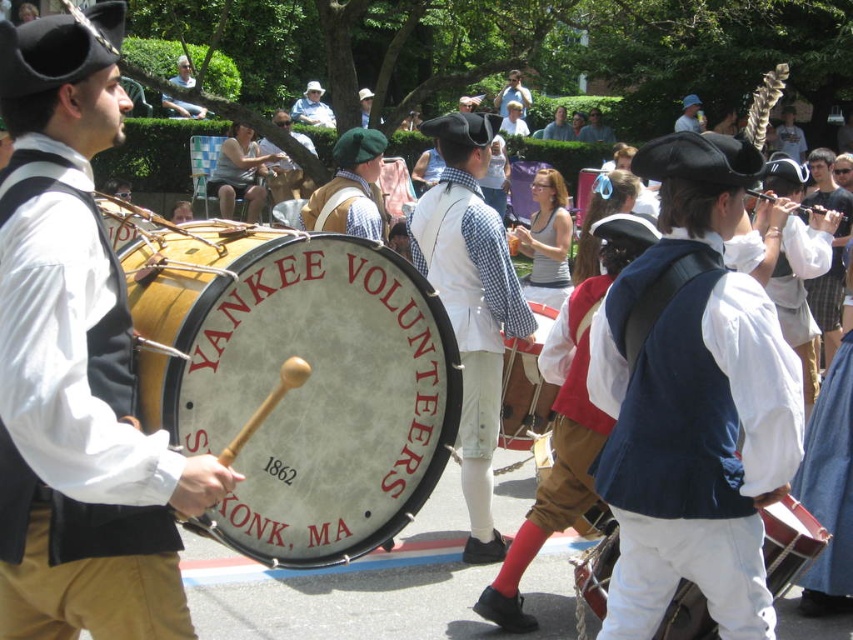
You are a photographer trying to capture the entire group in a single shot. You notice the wooden drum at center and the blue denim hat at upper center. Which object should you focus on first to ensure both are in frame?

The wooden drum at center is positioned on the left side of blue denim hat at upper center, so you should focus on the blue denim hat at upper center first to ensure both are in frame.

You are a photographer positioned at the back of the parade. You want to take a photo that includes both the white checkered shirt at center and the wooden drum at center. Which object will appear taller in the photo?

The white checkered shirt at center will appear taller in the photo because it has a greater height compared to the wooden drum at center.